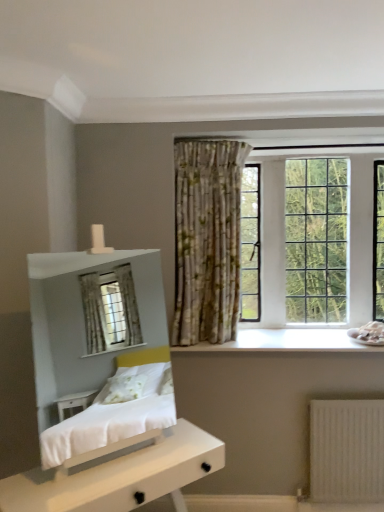
Question: In terms of height, does white matte nightstand at lower left look taller or shorter compared to white wood at center?

Choices:
 (A) short
 (B) tall

Answer: (B)

Question: Is white matte nightstand at lower left inside or outside of white wood at center?

Choices:
 (A) inside
 (B) outside

Answer: (B)

Question: Estimate the real-world distances between objects in this image. Which object is farther from the white matte nightstand at lower left?

Choices:
 (A) clear glass window at upper right
 (B) white wood at center

Answer: (A)

Question: Considering the real-world distances, which object is farthest from the white wood at center?

Choices:
 (A) clear glass window at upper right
 (B) white matte nightstand at lower left

Answer: (B)